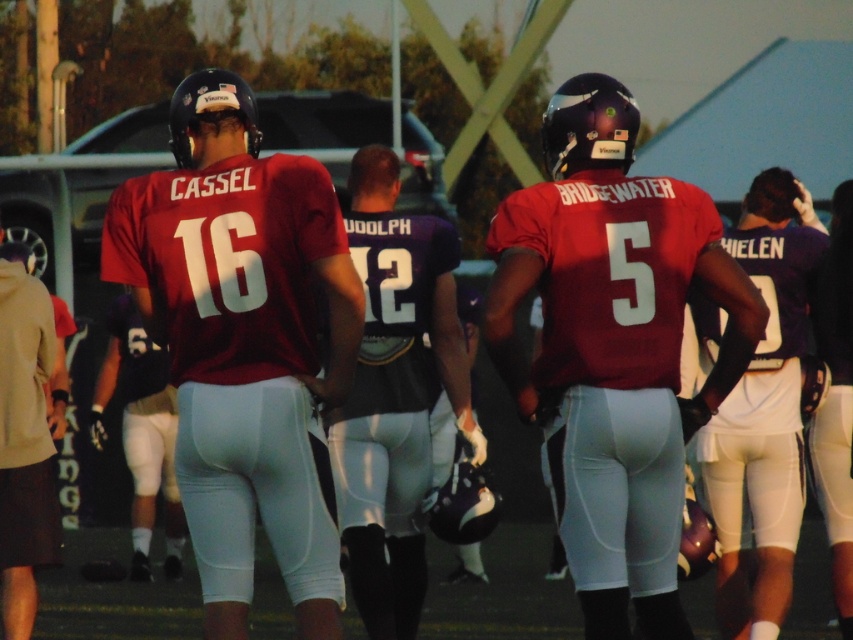
Question: Which point is closer to the camera taking this photo?

Choices:
 (A) (195, 84)
 (B) (598, 502)

Answer: (B)

Question: Among these objects, which one is nearest to the camera?

Choices:
 (A) matte maroon jersey at center
 (B) matte red jersey at center

Answer: (A)

Question: Does matte maroon jersey at center have a lesser width compared to matte red jersey at center?

Choices:
 (A) no
 (B) yes

Answer: (B)

Question: Is matte maroon jersey at center closer to camera compared to matte red jersey at center?

Choices:
 (A) no
 (B) yes

Answer: (B)

Question: Is matte maroon jersey at center bigger than matte red jersey at center?

Choices:
 (A) yes
 (B) no

Answer: (A)